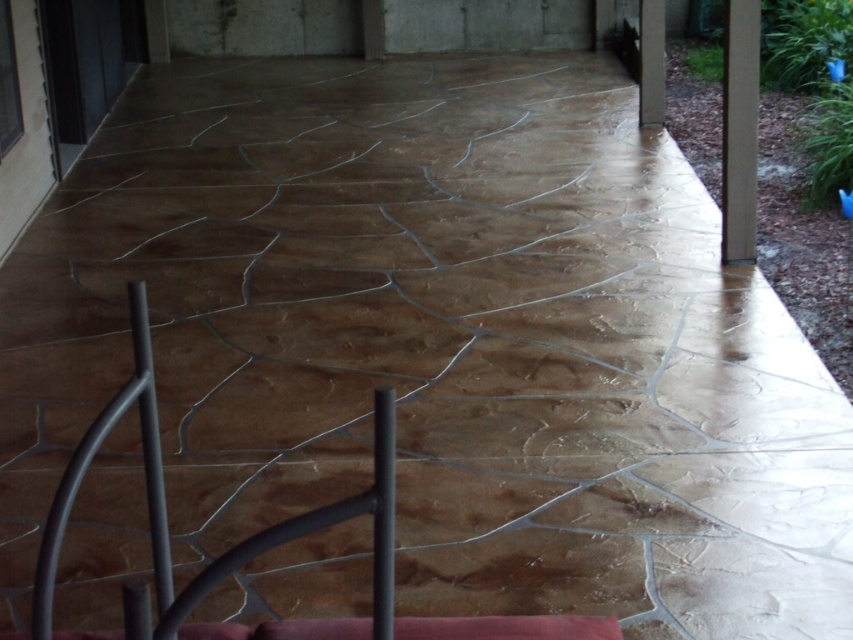
You are standing on the patio and want to reach the brown wood pillar at upper right. If your walking speed is 1.2 meters per second, how many seconds will it take you to reach it?

The distance to the brown wood pillar at upper right is 6.16 meters. At a speed of 1.2 meters per second, dividing 6.16 by 1.2 gives approximately 5.13 seconds. So, it will take roughly 5.13 seconds to reach the brown wood pillar at upper right.

You are a painter standing on the patio and need to paint the pillars. Which pillar, the brown wood pillar at upper right or the smooth concrete pillar at upper right, is located lower in the image?

The brown wood pillar at upper right is located below the smooth concrete pillar at upper right, so it is lower in the image.

You are designing a garden layout and need to place a tall plant stand between the brown wood pillar at upper right and the smooth concrete pillar at upper right. Which pillar should the plant stand be closer to in order to maintain visual balance?

The plant stand should be closer to the brown wood pillar at upper right because it is taller than the smooth concrete pillar at upper right, so placing the plant stand near the taller pillar helps balance the composition.